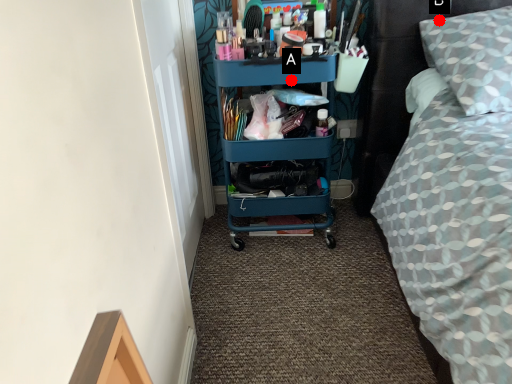
Question: Two points are circled on the image, labeled by A and B beside each circle. Which point appears closest to the camera in this image?

Choices:
 (A) A is closer
 (B) B is closer

Answer: (B)